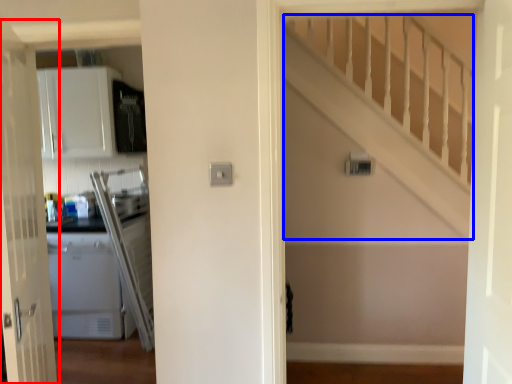
Question: Which object is further to the camera taking this photo, door (highlighted by a red box) or stairwell (highlighted by a blue box)?

Choices:
 (A) door
 (B) stairwell

Answer: (B)